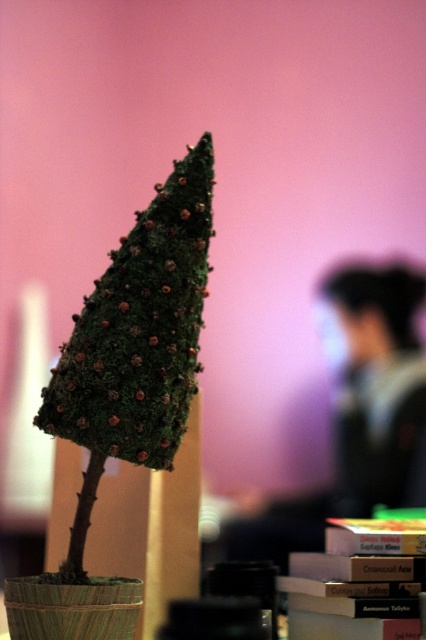
Question: Which object is closer to the camera taking this photo?

Choices:
 (A) dark hair at upper right
 (B) green mossy cone at center

Answer: (B)

Question: Among these points, which one is nearest to the camera?

Choices:
 (A) (288, 552)
 (B) (126, 276)
 (C) (419, 374)

Answer: (B)

Question: Considering the real-world distances, which object is farthest from the black fabric at upper center?

Choices:
 (A) dark hair at upper right
 (B) green mossy cone at center

Answer: (B)

Question: Can you confirm if green mossy cone at center is smaller than black fabric at upper center?

Choices:
 (A) no
 (B) yes

Answer: (A)

Question: Is the position of dark hair at upper right more distant than that of black fabric at upper center?

Choices:
 (A) no
 (B) yes

Answer: (A)

Question: Does dark hair at upper right appear on the right side of black fabric at upper center?

Choices:
 (A) yes
 (B) no

Answer: (B)